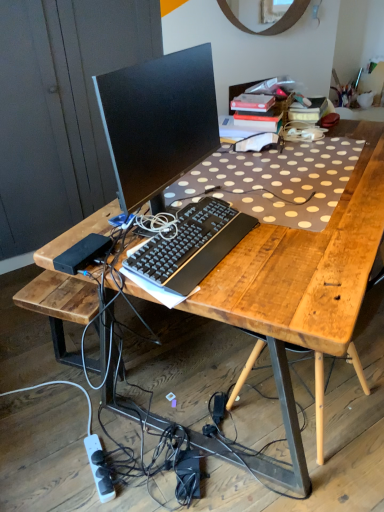
I want to click on vacant area that lies between wooden desk at center and white plastic power strip at lower left, so click(x=148, y=478).